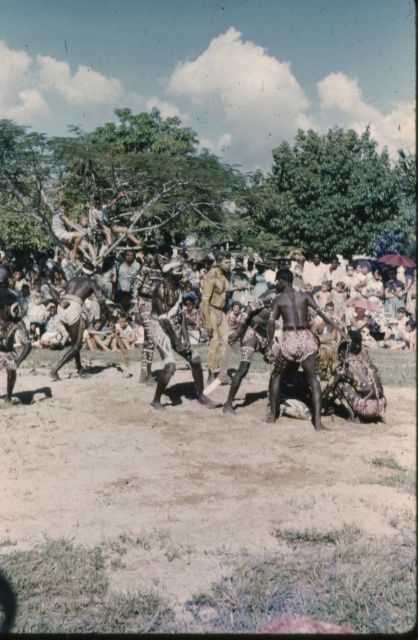
You are a costume designer preparing for a performance and need to choose between the printed fabric shorts at center and the brown textured fabric at center. Based on their sizes, which one would be more suitable for a child performer?

The printed fabric shorts at center has a smaller size compared to brown textured fabric at center, so it would be more suitable for a child performer.

You are a photographer trying to capture the entire scene of the brown sandy ground at center and the camouflage fabric uniform at center in one shot. Considering their sizes, which object should you focus on to ensure both are visible without cropping?

The brown sandy ground at center has a smaller size compared to camouflage fabric uniform at center, so you should focus on the camouflage fabric uniform at center to ensure both are visible without cropping.